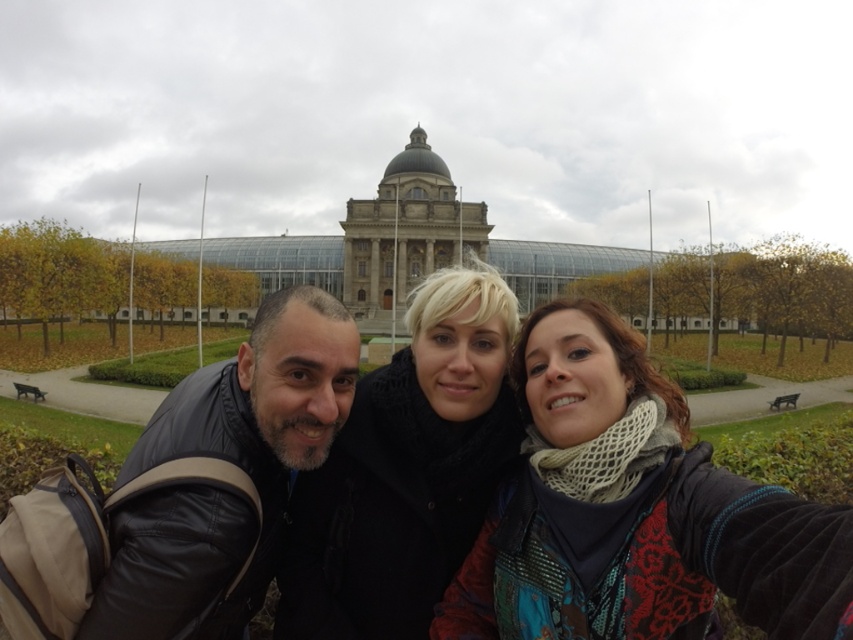
Which is above, black woolen scarf at center or black leather jacket at lower left?

black woolen scarf at center is above.

Is black woolen scarf at center shorter than black leather jacket at lower left?

In fact, black woolen scarf at center may be taller than black leather jacket at lower left.

Does point (451, 506) lie in front of point (120, 609)?

No.

Identify the location of black woolen scarf at center. (405, 470).

Locate an element on the screen. The image size is (853, 640). knitted scarf at center is located at coordinates (631, 513).

Is knitted scarf at center smaller than black leather jacket at lower left?

Incorrect, knitted scarf at center is not smaller in size than black leather jacket at lower left.

Who is more forward, (491, 515) or (120, 541)?

Point (120, 541)

At what (x,y) coordinates should I click in order to perform the action: click on knitted scarf at center. Please return your answer as a coordinate pair (x, y). The image size is (853, 640). Looking at the image, I should click on (631, 513).

Which of these two, knitted scarf at center or black woolen scarf at center, stands shorter?

With less height is knitted scarf at center.

Identify the location of knitted scarf at center. This screenshot has width=853, height=640. (631, 513).